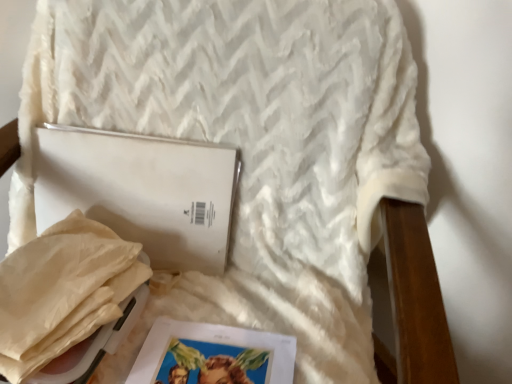
Identify the location of free space above beige paper bag at lower left (from a real-world perspective). Image resolution: width=512 pixels, height=384 pixels. (75, 298).